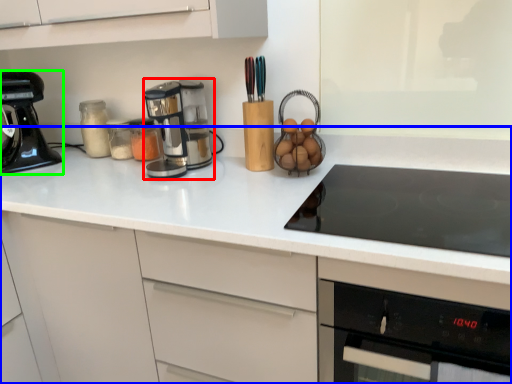
Question: Which object is the closest to the kitchen appliance (highlighted by a red box)? Choose among these: countertop (highlighted by a blue box) or kitchen appliance (highlighted by a green box).

Choices:
 (A) countertop
 (B) kitchen appliance

Answer: (A)